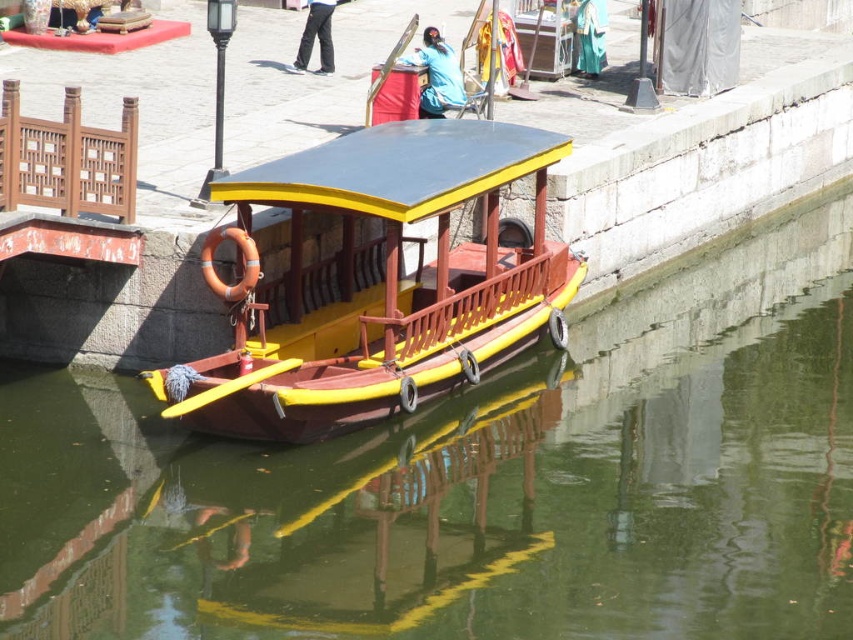
You are a tour guide explaining the canal scene to visitors. You mention the smooth green water at center and the blue fabric at upper center. How far apart are these two elements in feet?

The smooth green water at center and the blue fabric at upper center are 20.05 feet apart.

You are standing on the dock and looking at the wooden polished boat at center and the blue fabric at upper center. Which object is nearer to you?

The wooden polished boat at center is closer to the viewer than the blue fabric at upper center.

You are standing on the stone embankment next to the boat. You want to throw a small pebble into the water so it lands exactly at the center of the smooth green water at center. Based on the boat and the dock, where should you aim relative to the boat?

The smooth green water at center is located at point coordinates, so you should aim directly at the coordinates to hit the center.